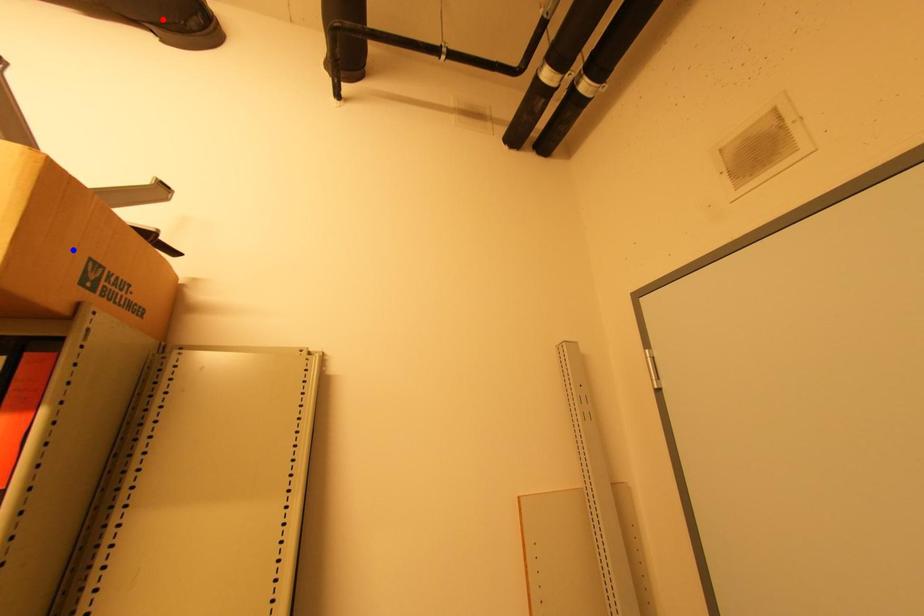
Question: In the image, two points are highlighted. Which point is nearer to the camera? Reply with the corresponding letter.

Choices:
 (A) blue point
 (B) red point

Answer: (A)